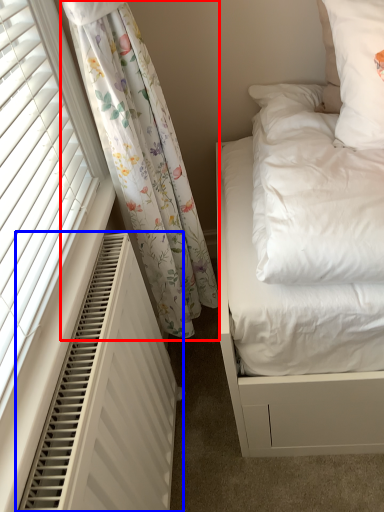
Question: Which object appears farthest to the camera in this image, curtain (highlighted by a red box) or air conditioner (highlighted by a blue box)?

Choices:
 (A) curtain
 (B) air conditioner

Answer: (A)